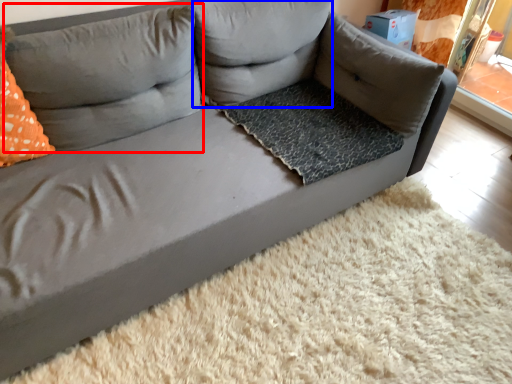
Question: Among these objects, which one is farthest to the camera, pillow (highlighted by a red box) or pillow (highlighted by a blue box)?

Choices:
 (A) pillow
 (B) pillow

Answer: (B)